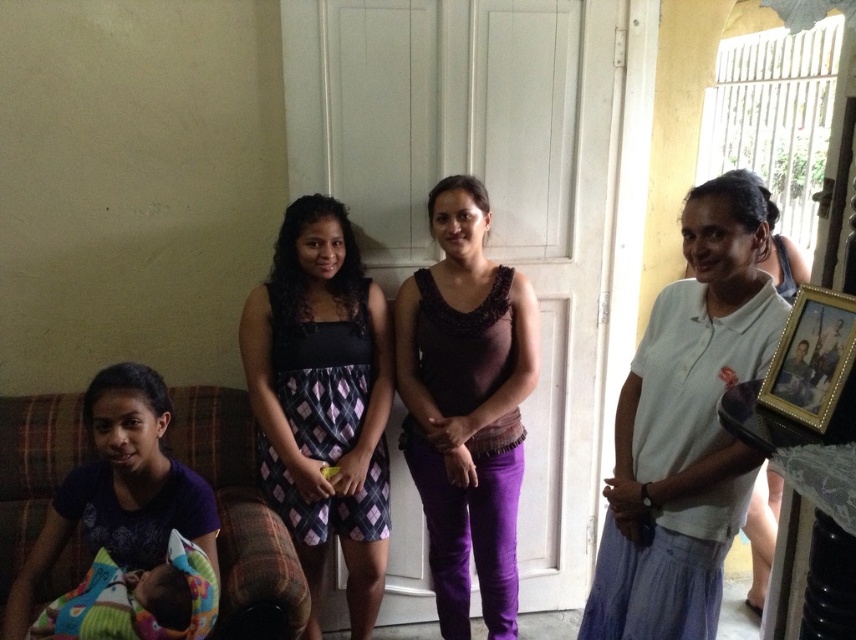
You are a delivery person entering through the closed white door in the background and need to place a package on the plaid fabric couch at lower left and the gold metallic photo frame at right. Which object will you reach first?

You will reach the plaid fabric couch at lower left first because it is closer to you than the gold metallic photo frame at right, which is further away.

You are a guest entering the room through the door. You want to sit down on the plaid fabric couch at lower left. To do so, you must first walk around the gold metallic photo frame at right. Is this necessary?

The plaid fabric couch at lower left is below the gold metallic photo frame at right, so you would need to move around the frame to reach the couch.